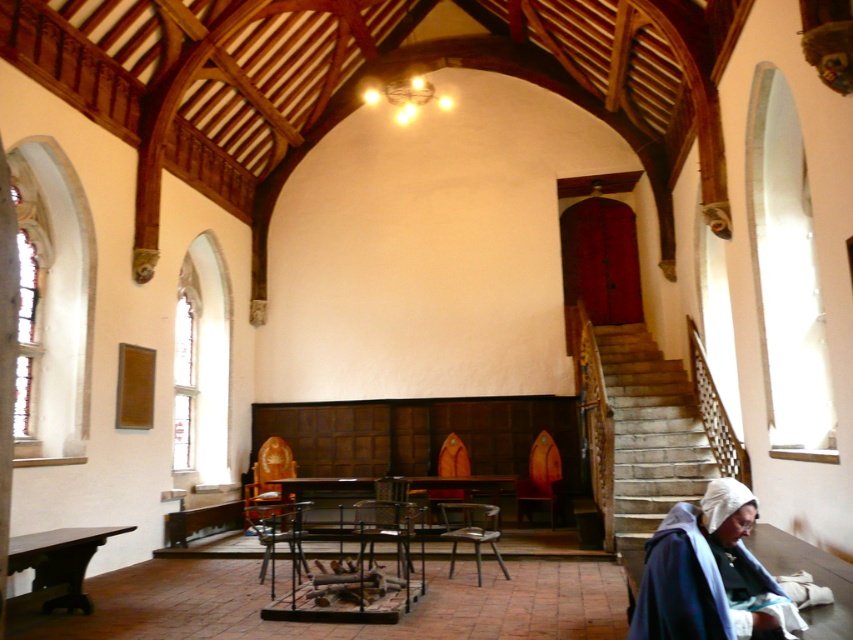
Who is more distant from viewer, (840, 596) or (439, 486)?

Point (439, 486)

Between wooden table at lower right and wooden table at center, which one has less height?

With less height is wooden table at center.

Find the location of a particular element. This screenshot has width=853, height=640. wooden table at lower right is located at coordinates (811, 577).

I want to click on wooden table at lower right, so click(x=811, y=577).

Is point (627, 381) closer to viewer compared to point (628, 586)?

No, (627, 381) is further to viewer.

Does wooden staircase at right appear on the left side of wooden table at lower right?

In fact, wooden staircase at right is to the right of wooden table at lower right.

Identify the location of wooden staircase at right. (648, 433).

Identify the location of wooden staircase at right. The image size is (853, 640). (648, 433).